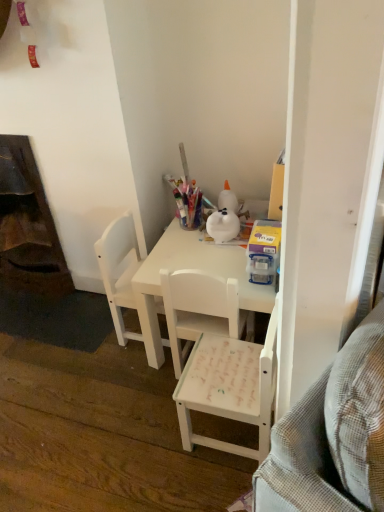
Question: Looking at their shapes, would you say white matte chair at center, placed as the second chair when sorted from right to left, is wider or thinner than translucent plastic container at upper right?

Choices:
 (A) thin
 (B) wide

Answer: (B)

Question: Considering the positions of white matte chair at center, placed as the second chair when sorted from right to left, and translucent plastic container at upper right in the image, is white matte chair at center, placed as the second chair when sorted from right to left, bigger or smaller than translucent plastic container at upper right?

Choices:
 (A) big
 (B) small

Answer: (A)

Question: Estimate the real-world distances between objects in this image. Which object is closer to the white matte chair at center, which is counted as the third chair, starting from the right?

Choices:
 (A) white matte desk at center
 (B) dark wood fireplace at left
 (C) translucent plastic container at upper right
 (D) white matte chair at center, which ranks as the 2th chair in left-to-right order
 (E) white matte chair at center, which is the 3th chair in left-to-right order

Answer: (A)

Question: Based on their relative distances, which object is nearer to the dark wood fireplace at left?

Choices:
 (A) white matte chair at center, which is counted as the third chair, starting from the right
 (B) translucent plastic container at upper right
 (C) white matte desk at center
 (D) white matte chair at center, placed as the second chair when sorted from right to left
 (E) white matte chair at center, which is the 3th chair in left-to-right order

Answer: (A)